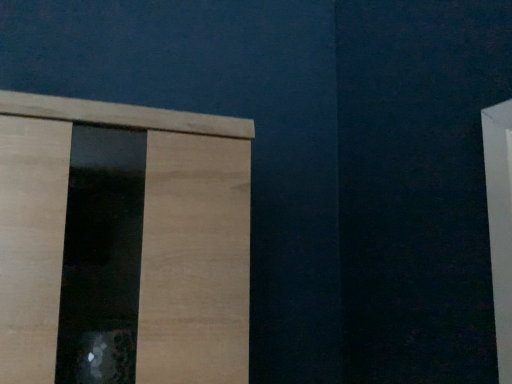
In order to face natural wood cabinet at left, should I rotate leftwards or rightwards?

It's best to rotate left around 19.122 degrees.

Locate an element on the screen. This screenshot has width=512, height=384. natural wood cabinet at left is located at coordinates (122, 244).

What do you see at coordinates (122, 244) in the screenshot? This screenshot has width=512, height=384. I see `natural wood cabinet at left` at bounding box center [122, 244].

What is the approximate height of natural wood cabinet at left?

46.26 centimeters.

At what (x,y) coordinates should I click in order to perform the action: click on natural wood cabinet at left. Please return your answer as a coordinate pair (x, y). This screenshot has width=512, height=384. Looking at the image, I should click on (122, 244).